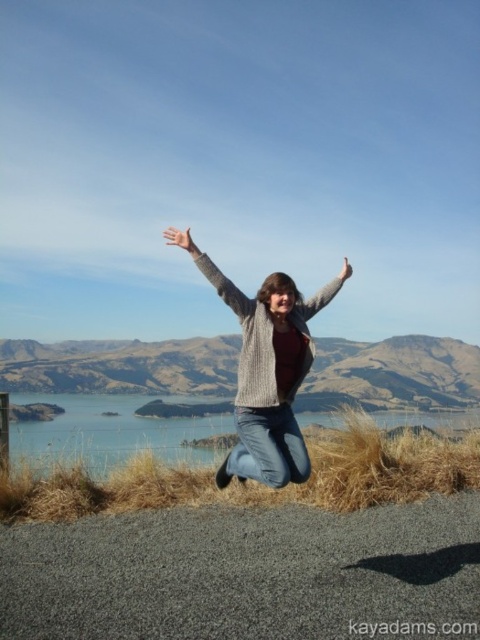
Question: Which point is closer to the camera taking this photo?

Choices:
 (A) (264, 285)
 (B) (216, 276)

Answer: (B)

Question: Which point is closer to the camera?

Choices:
 (A) (231, 284)
 (B) (172, 227)
 (C) (140, 435)

Answer: (A)

Question: Does knitted sweater at center come in front of gray woolen sweater at upper center?

Choices:
 (A) yes
 (B) no

Answer: (A)

Question: Is blue water at center above gray woolen sweater at upper center?

Choices:
 (A) yes
 (B) no

Answer: (B)

Question: Can you confirm if knitted sweater at center is wider than gray woolen sweater at upper center?

Choices:
 (A) yes
 (B) no

Answer: (A)

Question: Which point appears farthest from the camera in this image?

Choices:
 (A) (248, 300)
 (B) (92, 440)
 (C) (304, 346)

Answer: (B)